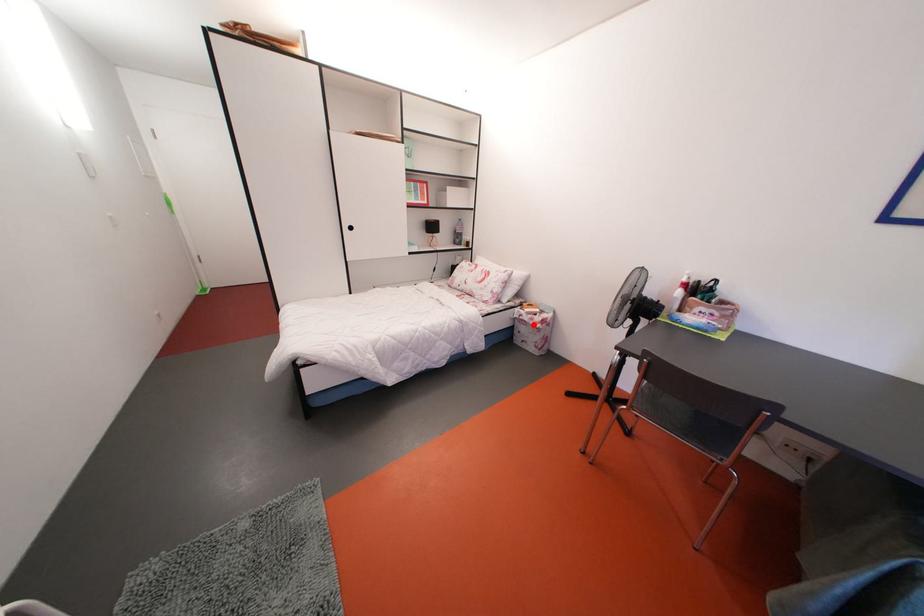
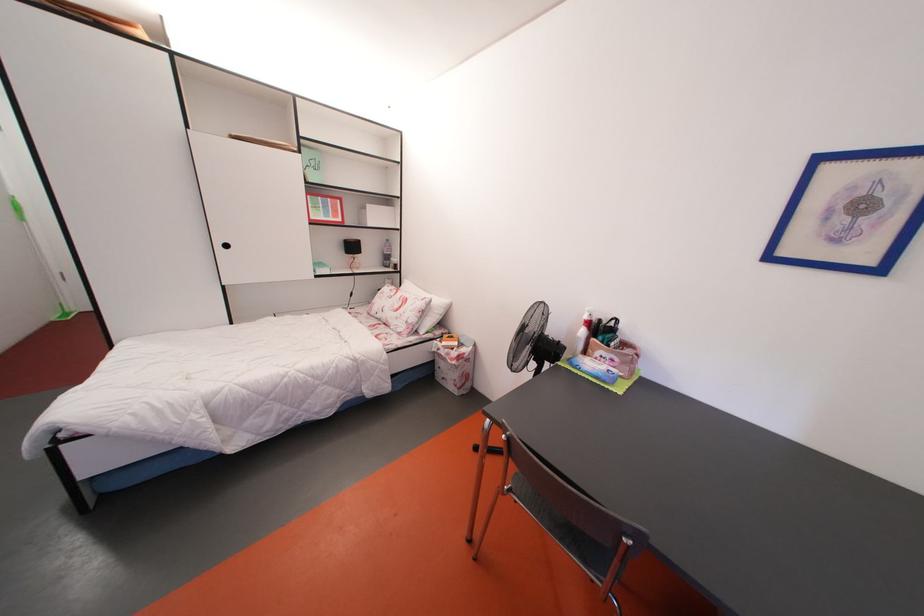
The point at the highlighted location is marked in the first image. Where is the corresponding point in the second image?

(450, 360)